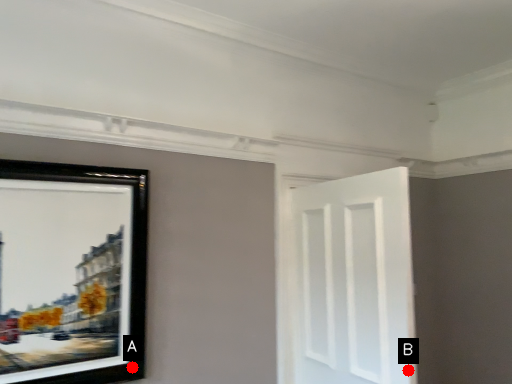
Question: Two points are circled on the image, labeled by A and B beside each circle. Which point appears closest to the camera in this image?

Choices:
 (A) A is closer
 (B) B is closer

Answer: (B)